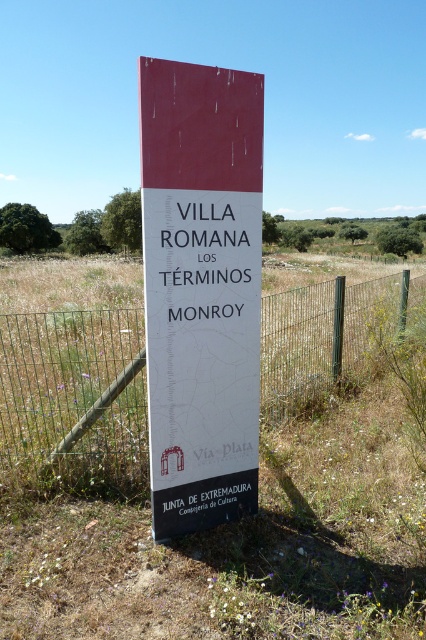
You are a visitor approaching the signpost and notice the metal wire fence at center and the black metal pole at center. Which object appears larger in size?

The metal wire fence at center is bigger than the black metal pole at center, so the metal wire fence at center appears larger in size.

You are standing in front of the signpost described. There is a specific point at coordinates (201, 289) on the sign. Based on the description, can you determine which part of the sign this point is located on?

The point at coordinates (201, 289) is on the matte red sign at center, as stated in the description.